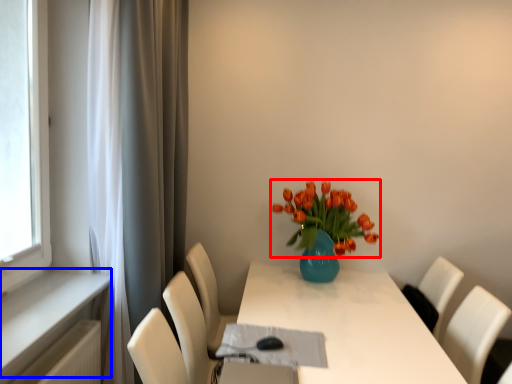
Question: Among these objects, which one is nearest to the camera, flower (highlighted by a red box) or window sill (highlighted by a blue box)?

Choices:
 (A) flower
 (B) window sill

Answer: (B)